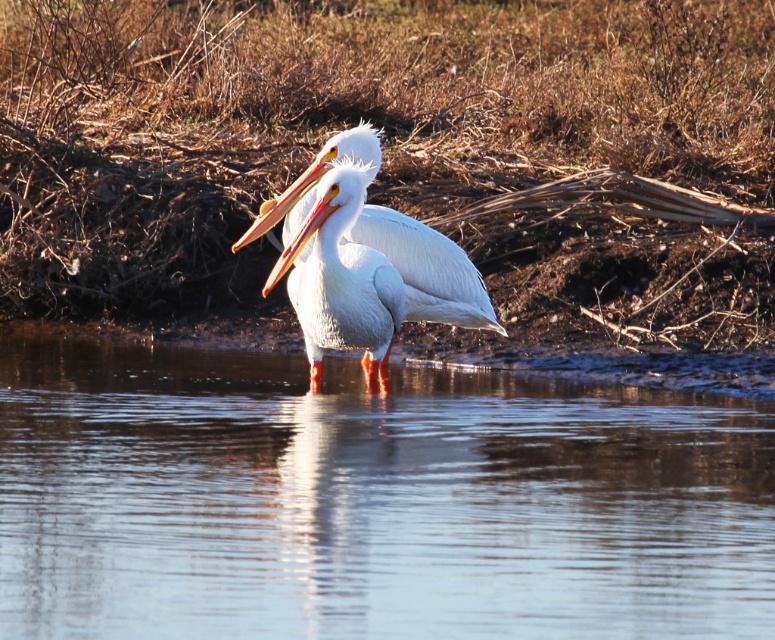
Measure the distance from white smooth pelican at center to matte orange beak at center.

The distance of white smooth pelican at center from matte orange beak at center is 27.43 inches.

This screenshot has height=640, width=775. Identify the location of white smooth pelican at center. (426, 269).

Is point (481, 312) closer to camera compared to point (298, 252)?

No, (481, 312) is further to viewer.

This screenshot has width=775, height=640. Identify the location of white smooth pelican at center. (426, 269).

Is white smooth pelican at center thinner than white glossy beak at center?

In fact, white smooth pelican at center might be wider than white glossy beak at center.

Where is `white smooth pelican at center`? white smooth pelican at center is located at coordinates (426, 269).

Image resolution: width=775 pixels, height=640 pixels. What are the coordinates of `clear water at center` in the screenshot? It's located at (370, 500).

Looking at this image, is clear water at center behind matte orange beak at center?

No, clear water at center is closer to the viewer.

At what (x,y) coordinates should I click in order to perform the action: click on clear water at center. Please return your answer as a coordinate pair (x, y). This screenshot has height=640, width=775. Looking at the image, I should click on (370, 500).

You are a GUI agent. You are given a task and a screenshot of the screen. Output one action in this format:
    pyautogui.click(x=<x>, y=<y>)
    Task: Click on the clear water at center
    This screenshot has width=775, height=640.
    Given the screenshot: What is the action you would take?
    pyautogui.click(x=370, y=500)